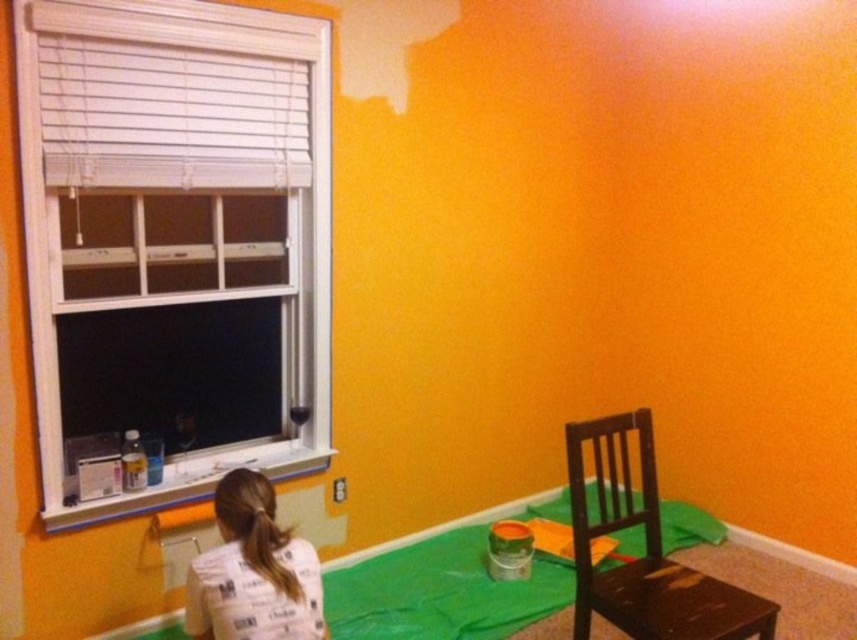
Question: Which object is closer to the camera taking this photo?

Choices:
 (A) white plastic window at left
 (B) dark brown wooden chair at lower right
 (C) white paper bag at lower center

Answer: (C)

Question: Does white plastic window at left appear under dark brown wooden chair at lower right?

Choices:
 (A) no
 (B) yes

Answer: (A)

Question: Does dark brown wooden chair at lower right appear on the left side of white paper bag at lower center?

Choices:
 (A) yes
 (B) no

Answer: (B)

Question: Which point is farther to the camera?

Choices:
 (A) (232, 170)
 (B) (727, 620)

Answer: (A)

Question: Based on their relative distances, which object is farther from the white paper bag at lower center?

Choices:
 (A) white plastic window at left
 (B) dark brown wooden chair at lower right

Answer: (B)

Question: Is white plastic window at left above dark brown wooden chair at lower right?

Choices:
 (A) no
 (B) yes

Answer: (B)